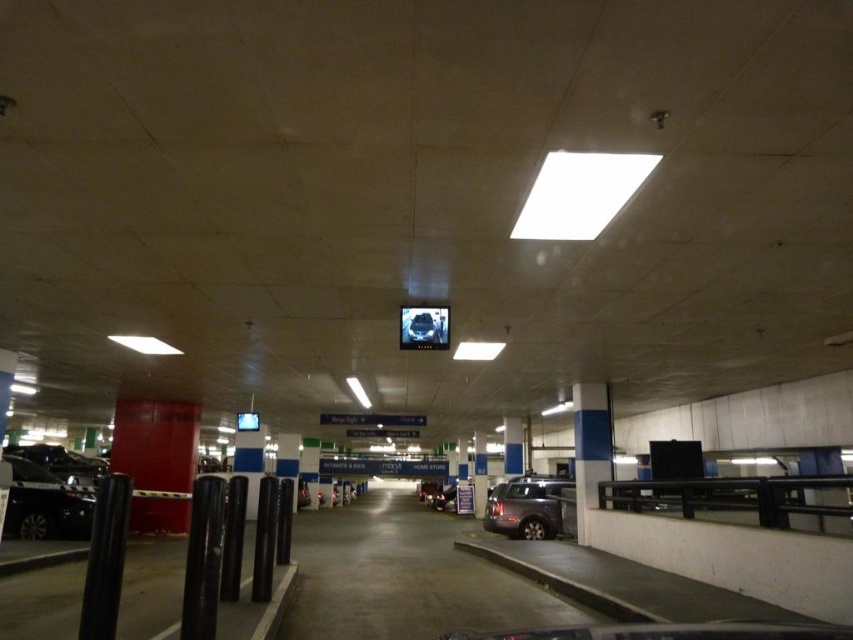
Question: Which object is positioned farthest from the shiny black car at lower left?

Choices:
 (A) metallic silver suv at center
 (B) metallic gray suv at center

Answer: (B)

Question: Is metallic silver suv at center wider than metallic gray suv at center?

Choices:
 (A) no
 (B) yes

Answer: (A)

Question: Which object is positioned closest to the metallic silver suv at center?

Choices:
 (A) shiny black car at lower left
 (B) metallic gray suv at center

Answer: (A)

Question: Which point appears closest to the camera in this image?

Choices:
 (A) (78, 520)
 (B) (444, 500)
 (C) (485, 513)

Answer: (A)

Question: Can you confirm if shiny black car at lower left is positioned to the right of metallic silver suv at center?

Choices:
 (A) yes
 (B) no

Answer: (B)

Question: Does shiny black car at lower left appear on the right side of metallic silver suv at center?

Choices:
 (A) yes
 (B) no

Answer: (B)